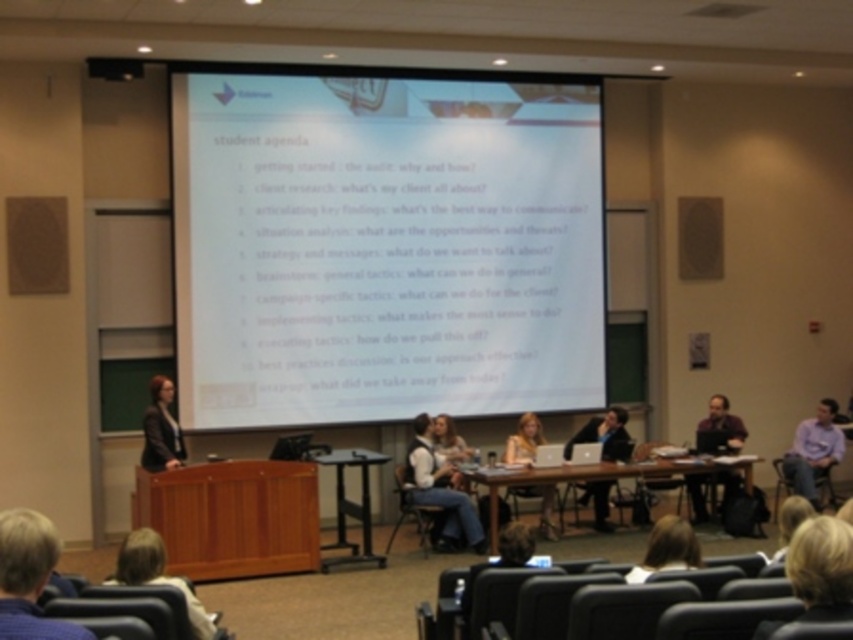
You are a presenter who needs to place a 3 feet wide laptop on the metallic silver table at center. Can you fit the laptop on the table?

The metallic silver table at center is 29.07 feet away from camera, but the table width is not provided. Therefore, it is impossible to determine if the laptop will fit.

You are a presenter standing at the wooden table at center. You need to walk to the projection screen to adjust the slide. Which direction should you move relative to your current position?

Since the wooden table at center is positioned at point (598, 476), you should move forward towards the projection screen to adjust the slide.

Looking at this image, you are an attendee at the presentation. You need to place a name tag on the metallic silver table at center. However, you notice the dark gray suit at center is currently occupying the space above the table. Can you place the name tag on the table without moving the suit?

The metallic silver table at center is located below dark gray suit at center, so the dark gray suit is above the table. Since the suit is occupying the space above, you can still place the name tag on the table as the suit is not on the table itself but above it. The vertical positioning allows access to the table surface.